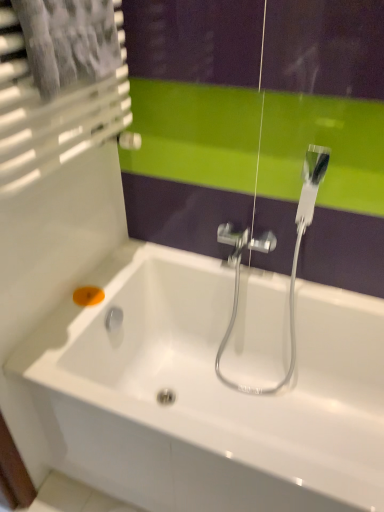
Locate an element on the screen. This screenshot has width=384, height=512. free space behind orange matte soap at lower left is located at coordinates (118, 272).